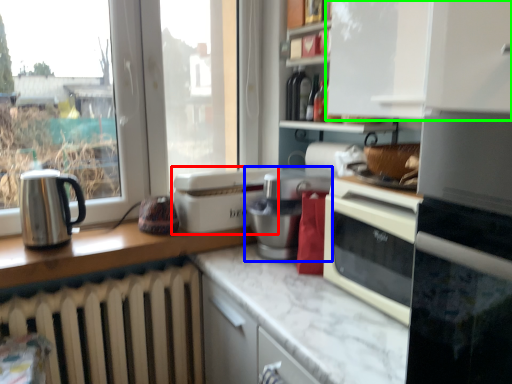
Question: Which object is positioned farthest from kitchen appliance (highlighted by a red box)? Select from appliance (highlighted by a blue box) and cabinetry (highlighted by a green box).

Choices:
 (A) appliance
 (B) cabinetry

Answer: (B)